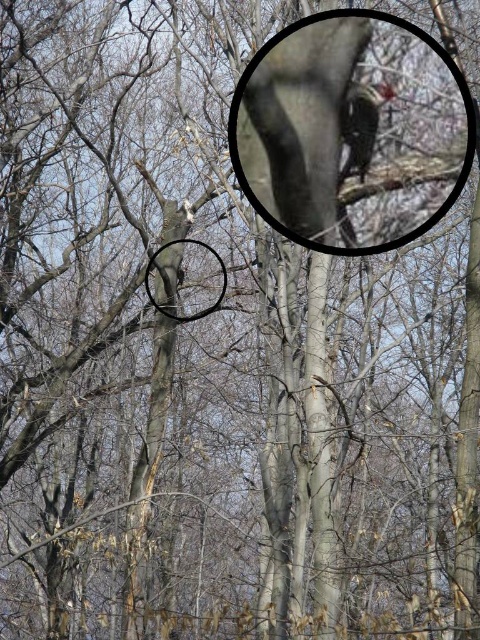
Question: Which of the following is the farthest from the observer?

Choices:
 (A) smooth brown woodpecker at upper center
 (B) smooth gray basketball hoop at center

Answer: (B)

Question: Which point is farther from the camera taking this photo?

Choices:
 (A) (359, 90)
 (B) (202, 314)

Answer: (B)

Question: Observing the image, what is the correct spatial positioning of smooth brown woodpecker at upper center in reference to smooth gray basketball hoop at center?

Choices:
 (A) below
 (B) above

Answer: (B)

Question: From the image, what is the correct spatial relationship of smooth brown woodpecker at upper center in relation to smooth gray basketball hoop at center?

Choices:
 (A) above
 (B) below

Answer: (A)

Question: Does smooth brown woodpecker at upper center have a larger size compared to smooth gray basketball hoop at center?

Choices:
 (A) yes
 (B) no

Answer: (B)